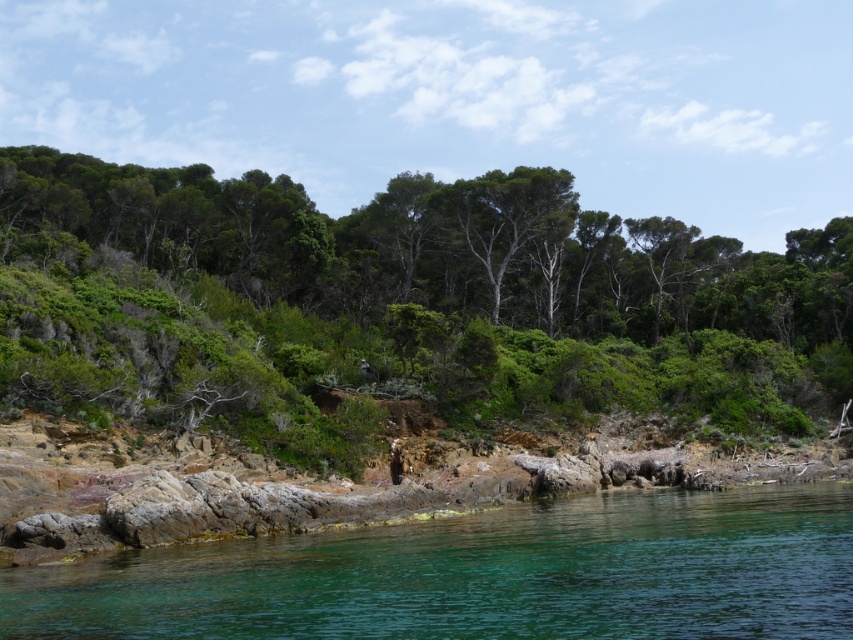
Based on the photo, you are standing at the origin point in the coastal landscape. The green leafy trees at center are positioned at coordinates approximately 0.477 on the x and 0.468 on the y. If you want to walk directly towards these trees, in which general direction should you head?

The green leafy trees at center are located at coordinates approximately 0.477 on the x and 0.468 on the y. Since the origin is at the bottom left corner, moving towards the center would involve heading northeast.

You are a hiker who wants to cross from the green leafy trees at center to the clear water at lower left. Can you safely walk directly between them if your path requires a distance of 30 meters? Please explain.

The distance between the green leafy trees at center and the clear water at lower left is 35.78 meters. Since your required path is 30 meters, which is shorter than the actual distance, you cannot walk directly between them as the distance is greater than 30 meters.